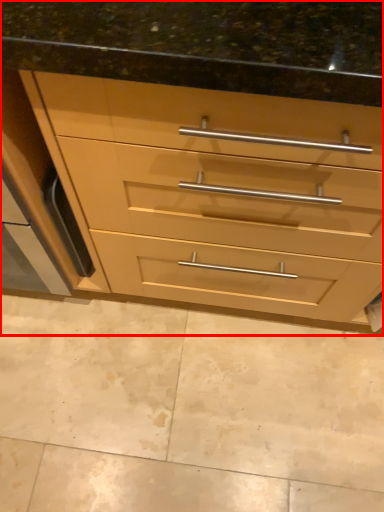
Question: From the image's perspective, where is chest of drawers (annotated by the red box) located in relation to granite in the image?

Choices:
 (A) below
 (B) above

Answer: (B)